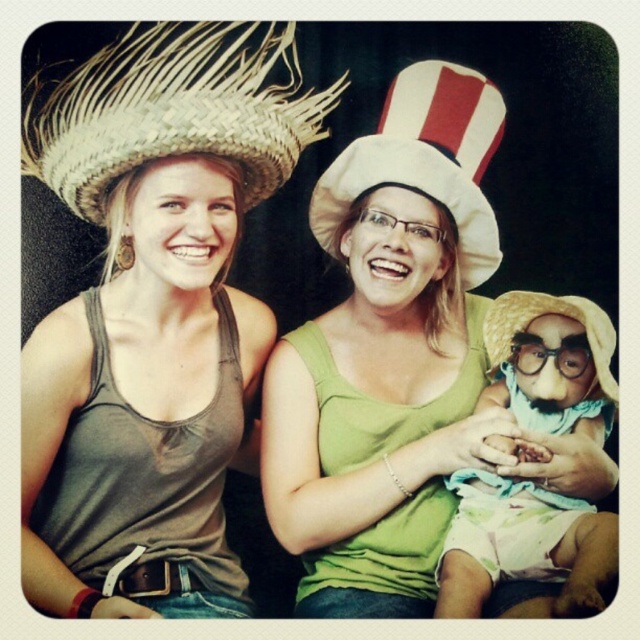
Looking at the image, there are two straw hats present. The woven straw hat at upper left and the light yellow straw hat at lower right. Which of these two hats is positioned to the left side of the other?

The woven straw hat at upper left is positioned to the left of the light yellow straw hat at lower right.

You are standing in front of the image and want to determine which of the two points, point (x=154, y=152) or point (x=608, y=556), is nearer to you. Based on the spatial arrangement in the image, which point is closer?

Point (x=154, y=152) is closer to the viewer than point (x=608, y=556) according to the description.